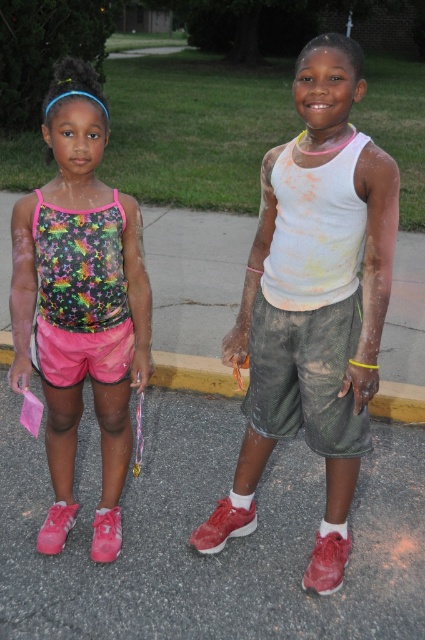
Does neon pink fabric tank top at left have a larger size compared to yellow concrete curb at center?

Correct, neon pink fabric tank top at left is larger in size than yellow concrete curb at center.

Does neon pink fabric tank top at left appear on the right side of yellow concrete curb at center?

No, neon pink fabric tank top at left is not to the right of yellow concrete curb at center.

Find the location of a particular element. neon pink fabric tank top at left is located at coordinates (79, 301).

You are a GUI agent. You are given a task and a screenshot of the screen. Output one action in this format:
    pyautogui.click(x=<x>, y=<y>)
    Task: Click on the neon pink fabric tank top at left
    
    Given the screenshot: What is the action you would take?
    pos(79,301)

Does gray asphalt pavement at center have a larger size compared to yellow concrete curb at center?

Yes.

Does point (198, 627) come in front of point (155, 381)?

Yes.

I want to click on gray asphalt pavement at center, so click(201, 522).

Can you confirm if white matte tank top at center is positioned to the right of neon pink fabric tank top at left?

Indeed, white matte tank top at center is positioned on the right side of neon pink fabric tank top at left.

Is point (342, 99) behind point (61, 221)?

That is False.

Where is `white matte tank top at center`? The image size is (425, 640). white matte tank top at center is located at coordinates (314, 301).